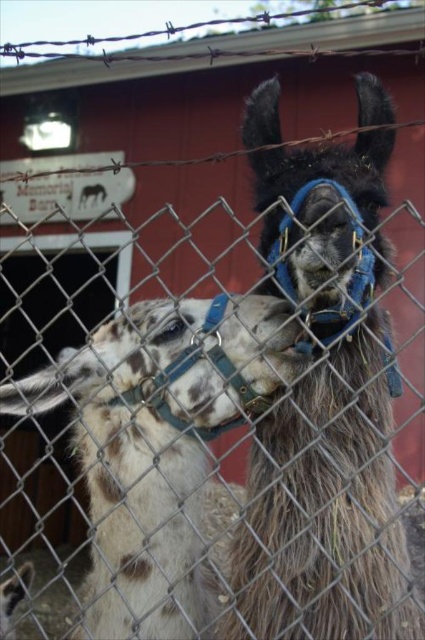
You are standing in front of the fence and want to locate the dark brown woolen alpaca at center. Based on the coordinates given, where should you look relative to the fence?

The dark brown woolen alpaca at center is located at coordinates point (325,401), which means it is positioned to the right and slightly above the center of the fence.